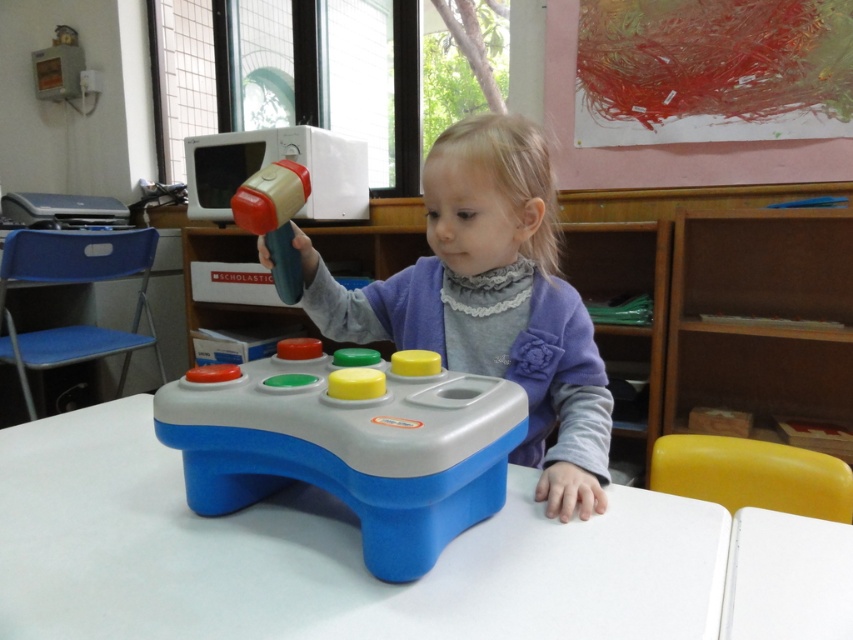
Can you confirm if blue plastic table at center is wider than rubberized plastic hammer at upper center?

Correct, the width of blue plastic table at center exceeds that of rubberized plastic hammer at upper center.

Where is `blue plastic table at center`? The image size is (853, 640). blue plastic table at center is located at coordinates (320, 554).

Does matte plastic toddler at center have a smaller size compared to rubberized plastic hammer at upper center?

No.

You are a GUI agent. You are given a task and a screenshot of the screen. Output one action in this format:
    pyautogui.click(x=<x>, y=<y>)
    Task: Click on the matte plastic toddler at center
    The image size is (853, 640).
    Given the screenshot: What is the action you would take?
    pyautogui.click(x=491, y=300)

Identify the location of matte plastic toddler at center. (491, 300).

Is the position of blue plastic table at center more distant than that of blue plastic gamepad at center?

No.

Between blue plastic table at center and blue plastic gamepad at center, which one is positioned lower?

blue plastic table at center

The width and height of the screenshot is (853, 640). Find the location of `blue plastic table at center`. blue plastic table at center is located at coordinates (320, 554).